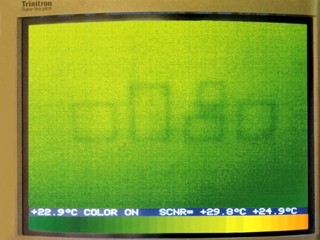
The width and height of the screenshot is (320, 240). What are the coordinates of `right monitor frame` in the screenshot? It's located at (316, 115).